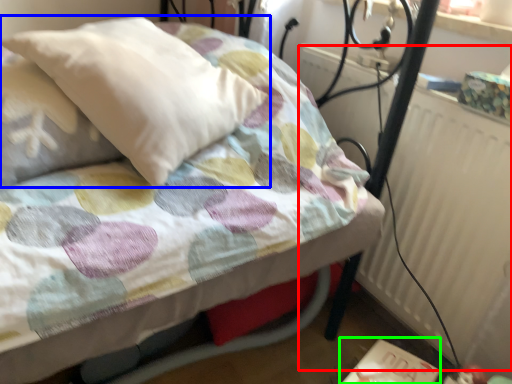
Question: Estimate the real-world distances between objects in this image. Which object is closer to radiator (highlighted by a red box), pillow (highlighted by a blue box) or table (highlighted by a green box)?

Choices:
 (A) pillow
 (B) table

Answer: (B)